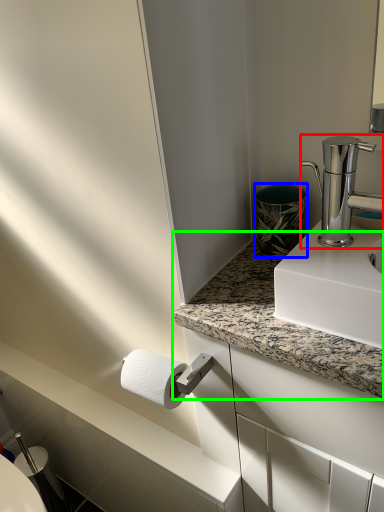
Question: Estimate the real-world distances between objects in this image. Which object is closer to tap (highlighted by a red box), appliance (highlighted by a blue box) or countertop (highlighted by a green box)?

Choices:
 (A) appliance
 (B) countertop

Answer: (A)